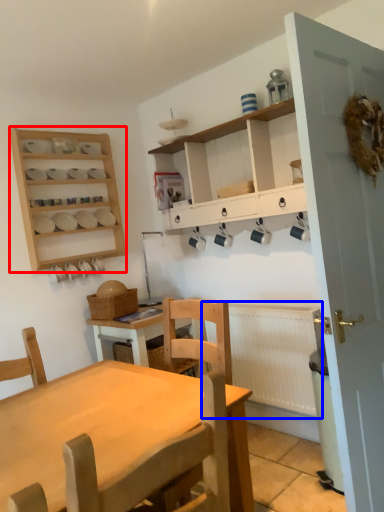
Question: Which point is further to the camera, shelf (highlighted by a red box) or radiator (highlighted by a blue box)?

Choices:
 (A) shelf
 (B) radiator

Answer: (A)